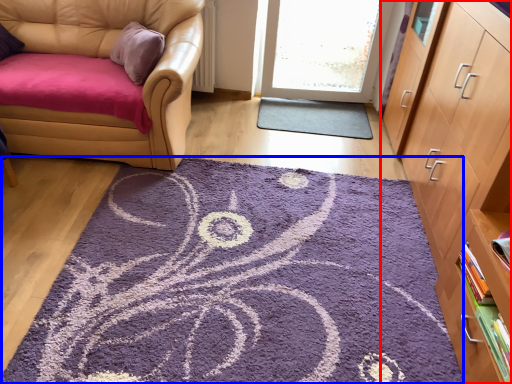
Question: Which point is closer to the camera, cabinetry (highlighted by a red box) or mat (highlighted by a blue box)?

Choices:
 (A) cabinetry
 (B) mat

Answer: (A)